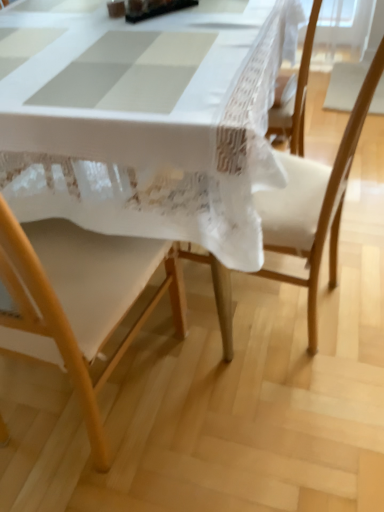
Find the location of a particular element. This screenshot has width=384, height=512. free region under wooden chair at lower left, acting as the 2th chair starting from the right (from a real-world perspective) is located at coordinates (77, 406).